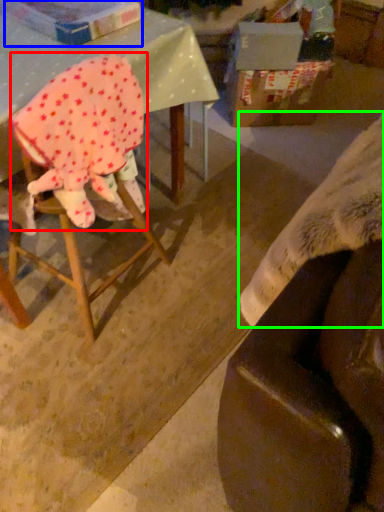
Question: Which object is positioned farthest from woman (highlighted by a red box)? Select from cardboard box (highlighted by a blue box) and blanket (highlighted by a green box).

Choices:
 (A) cardboard box
 (B) blanket

Answer: (B)